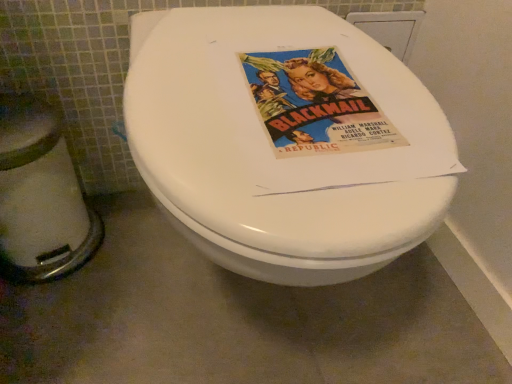
Find the location of a particular element. white glossy toilet seat at center is located at coordinates (286, 141).

What do you see at coordinates (286, 141) in the screenshot? I see `white glossy toilet seat at center` at bounding box center [286, 141].

Identify the location of white glossy toilet seat at center. This screenshot has height=384, width=512. (286, 141).